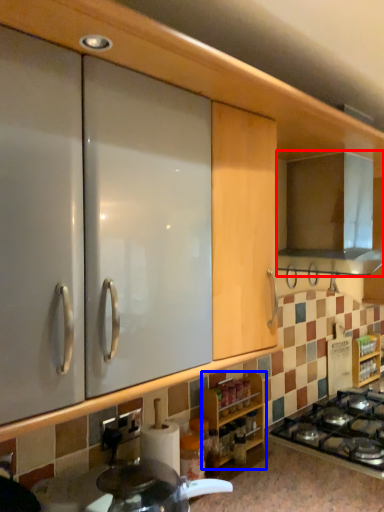
Question: Which object is closer to the camera taking this photo, home appliance (highlighted by a red box) or cabinetry (highlighted by a blue box)?

Choices:
 (A) home appliance
 (B) cabinetry

Answer: (B)